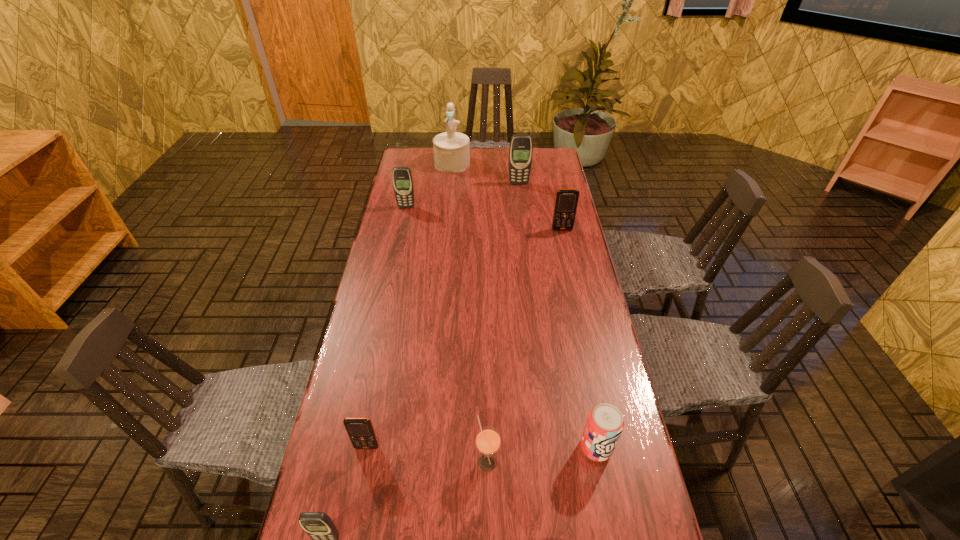
This screenshot has height=540, width=960. I want to click on vacant area in the image that satisfies the following two spatial constraints: 1. on the screen of the left orange cellular telephone; 2. on the right side of the soda can, so click(x=367, y=448).

I want to click on free spot that satisfies the following two spatial constraints: 1. on the screen of the nearer orange cellular telephone; 2. on the right side of the straw, so click(x=364, y=462).